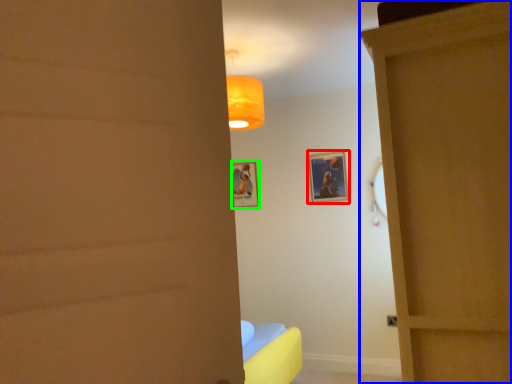
Question: Which is nearer to the picture frame (highlighted by a red box)? door (highlighted by a blue box) or picture frame (highlighted by a green box).

Choices:
 (A) door
 (B) picture frame

Answer: (B)